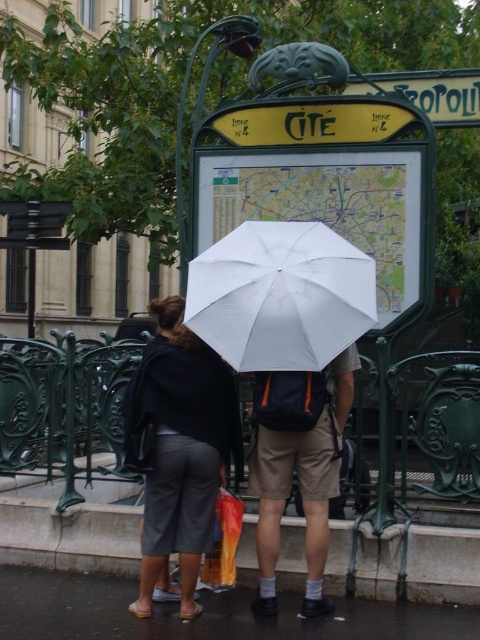
Question: Which point is closer to the camera?

Choices:
 (A) (256, 314)
 (B) (290, 440)
 (C) (203, 525)
 (D) (15, 605)

Answer: (A)

Question: Which of the following is the farthest from the observer?

Choices:
 (A) (459, 99)
 (B) (357, 358)

Answer: (A)

Question: Is dark gray fabric pants at lower left to the right of green metal sign at upper center from the viewer's perspective?

Choices:
 (A) no
 (B) yes

Answer: (A)

Question: From the image, what is the correct spatial relationship of dark gray asphalt at lower center in relation to khaki cotton shorts at center?

Choices:
 (A) above
 (B) below

Answer: (B)

Question: Which is nearer to the khaki cotton shorts at center?

Choices:
 (A) green metal sign at upper center
 (B) dark gray fabric pants at lower left
 (C) dark gray asphalt at lower center
 (D) white matte umbrella at center

Answer: (B)

Question: Is white matte umbrella at center closer to camera compared to khaki cotton shorts at center?

Choices:
 (A) yes
 (B) no

Answer: (A)